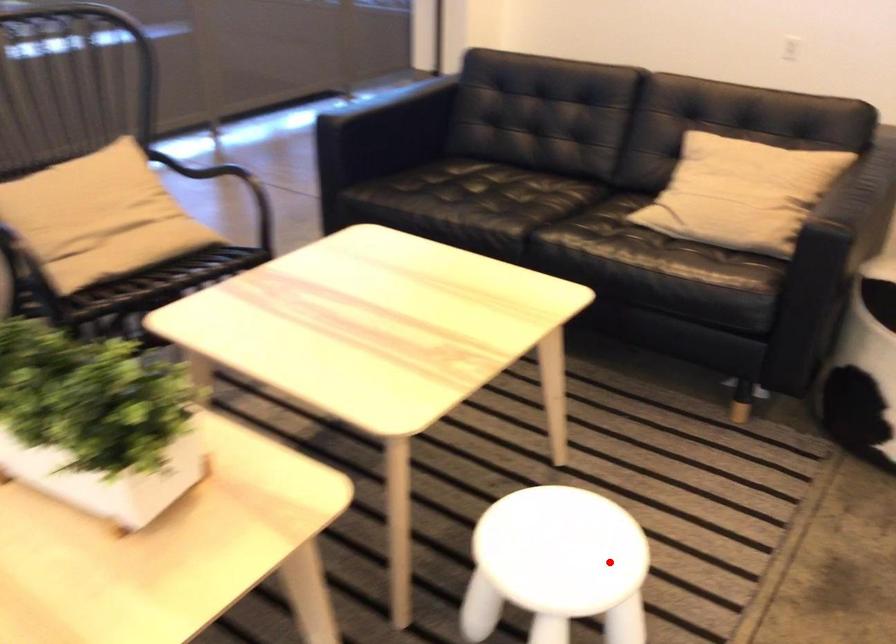
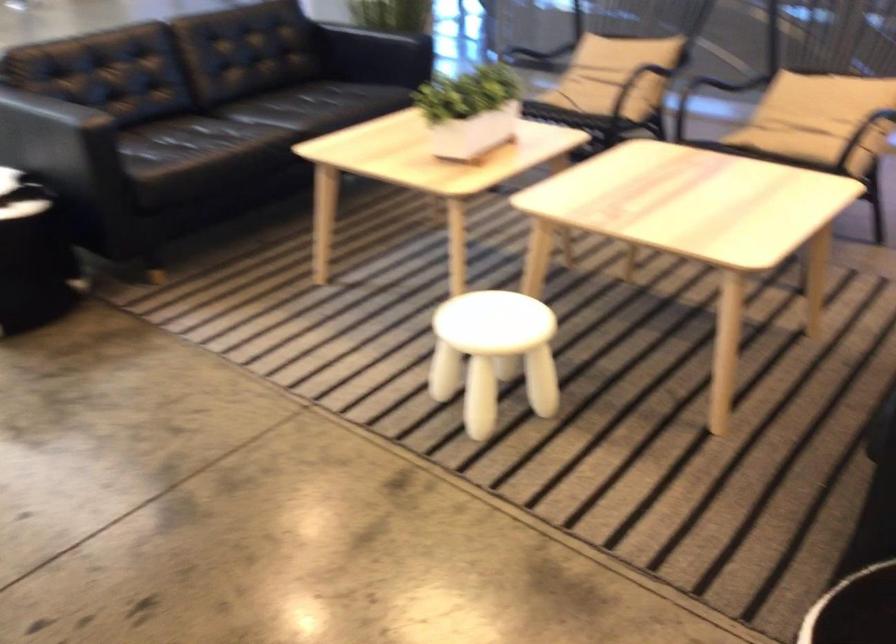
Question: A red point is marked in image1. In image2, is the corresponding 3D point closer to the camera or farther? Reply with the corresponding letter.

Choices:
 (A) The corresponding 3D point is closer.
 (B) The corresponding 3D point is farther.

Answer: (B)